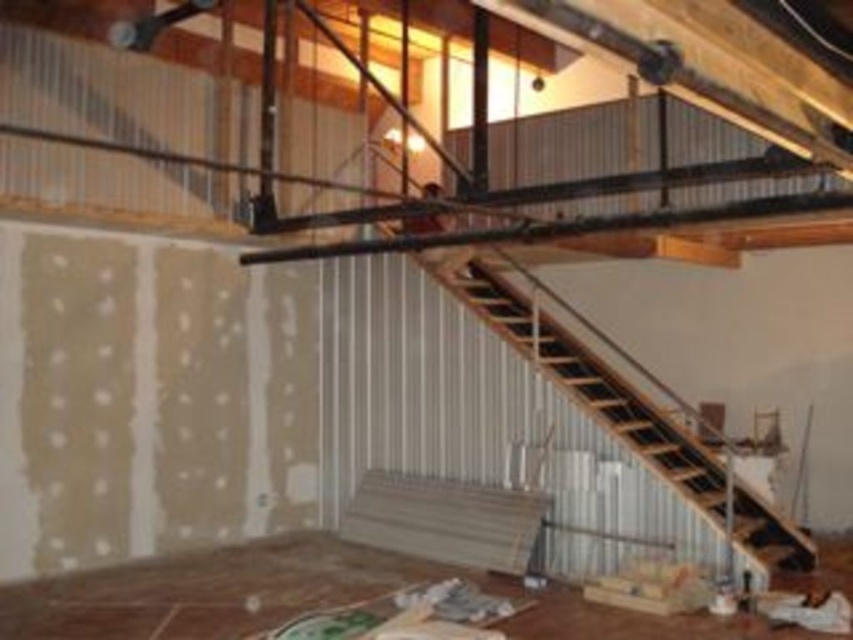
Question: Is wooden floor at lower left positioned in front of wooden stairs at center?

Choices:
 (A) no
 (B) yes

Answer: (A)

Question: Which of the following is the closest to the observer?

Choices:
 (A) (572, 360)
 (B) (12, 637)

Answer: (B)

Question: Is wooden floor at lower left smaller than wooden stairs at center?

Choices:
 (A) yes
 (B) no

Answer: (A)

Question: Among these points, which one is nearest to the camera?

Choices:
 (A) (361, 556)
 (B) (598, 397)

Answer: (A)

Question: Is the position of wooden floor at lower left less distant than that of wooden stairs at center?

Choices:
 (A) no
 (B) yes

Answer: (A)

Question: Which point is farther from the camera taking this photo?

Choices:
 (A) coord(33,592)
 (B) coord(627,406)

Answer: (B)